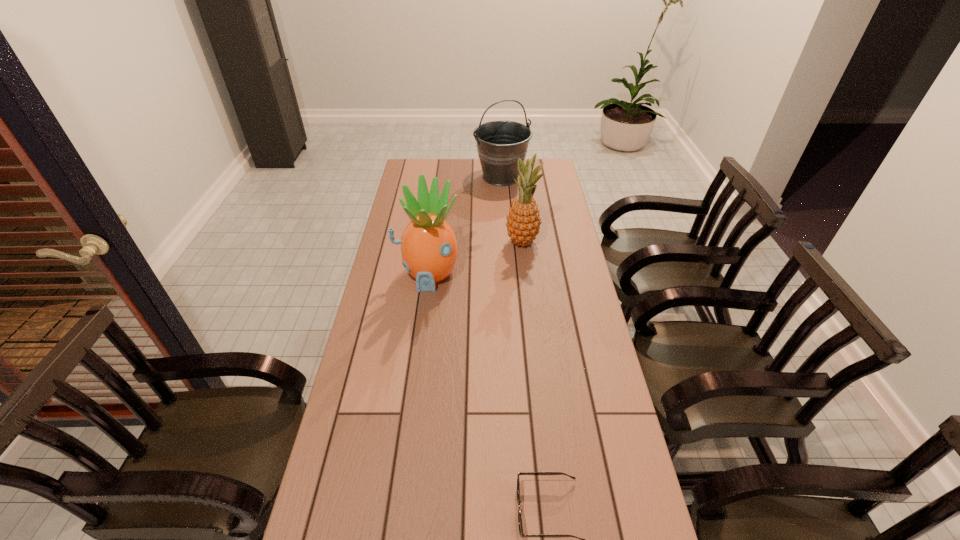
This screenshot has height=540, width=960. Identify the location of the second closest object to the leftmost object. (500, 143).